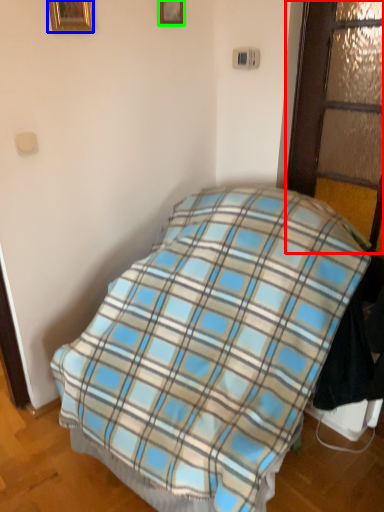
Question: Considering the real-world distances, which object is farthest from glass door (highlighted by a red box)? picture frame (highlighted by a blue box) or picture frame (highlighted by a green box)?

Choices:
 (A) picture frame
 (B) picture frame

Answer: (A)